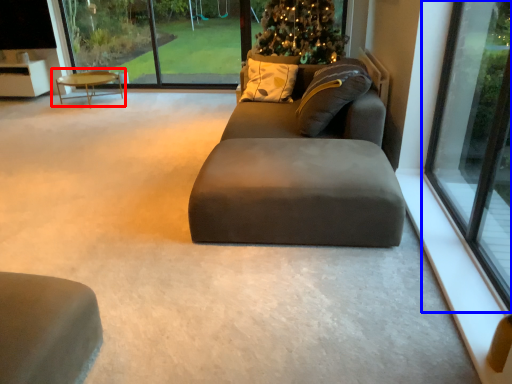
Question: Among these objects, which one is farthest to the camera, coffee table (highlighted by a red box) or window (highlighted by a blue box)?

Choices:
 (A) coffee table
 (B) window

Answer: (A)